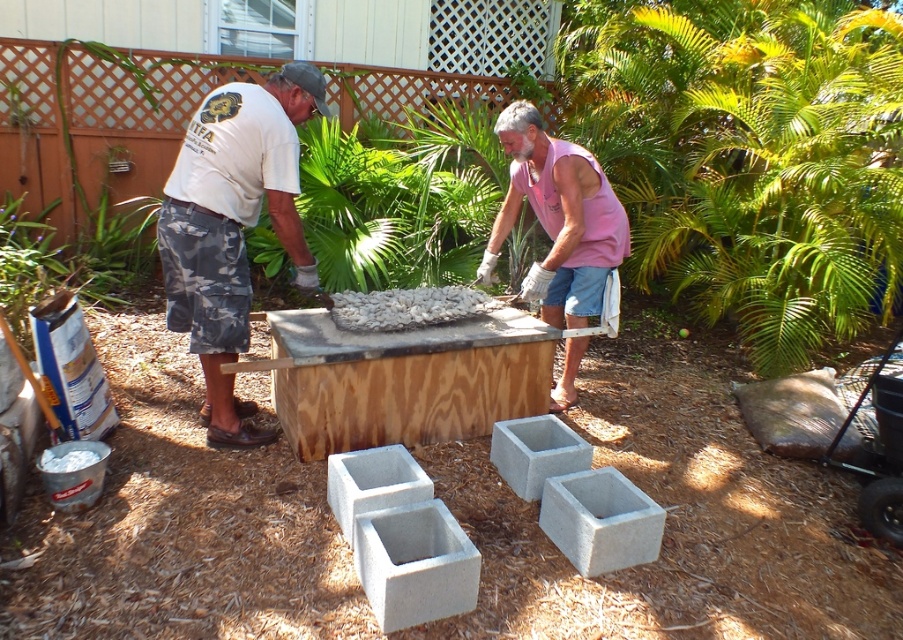
You are planning to place a new decorative item in the backyard. The white cotton shirt at upper left and the gray concrete block at center are already present. Which object occupies more space in the scene?

The white cotton shirt at upper left is bigger than the gray concrete block at center, so it occupies more space in the scene.

You are standing at the point labeled as point (x=603, y=552) and want to walk towards the point labeled as point (x=231, y=228). According to the scene description, which direction should you face to move towards the desired point?

To move from point (x=603, y=552) to point (x=231, y=228), you should face north because point (x=231, y=228) is behind point (x=603, y=552).